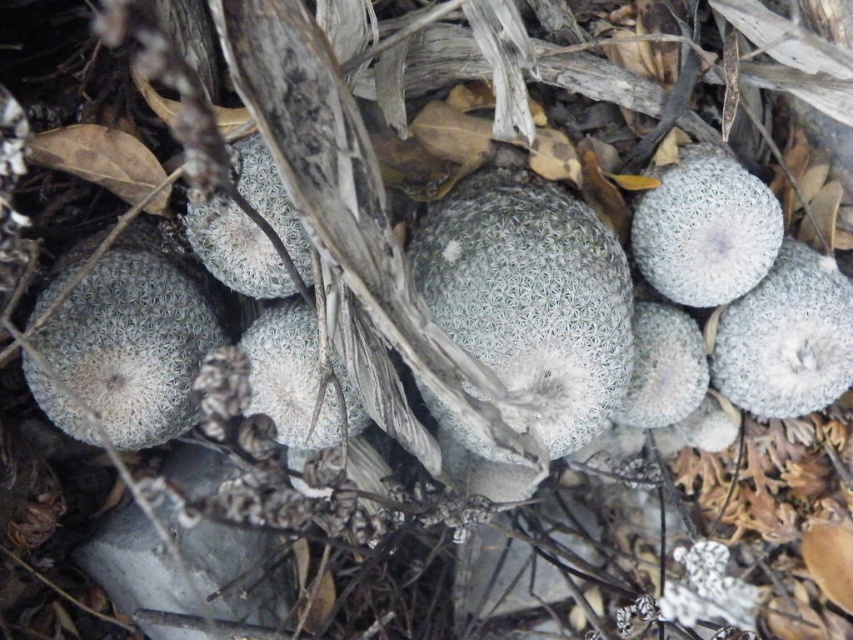
Question: From the image, what is the correct spatial relationship of gray fuzzy cactus at right in relation to white fuzzy cactus at upper right?

Choices:
 (A) below
 (B) above

Answer: (A)

Question: Which is nearer to the white fuzzy cactus at left?

Choices:
 (A) gray fuzzy cactus at right
 (B) white fuzzy cactus at upper right

Answer: (B)

Question: Observing the image, what is the correct spatial positioning of gray fuzzy cactus at right in reference to white fuzzy cactus at upper right?

Choices:
 (A) above
 (B) below

Answer: (B)

Question: Which object is positioned closest to the white fuzzy cactus at upper right?

Choices:
 (A) gray fuzzy cactus at right
 (B) white fuzzy cactus at left
 (C) white fuzzy cactus at center

Answer: (A)

Question: Can you confirm if white fuzzy cactus at center is positioned above white fuzzy cactus at upper right?

Choices:
 (A) yes
 (B) no

Answer: (B)

Question: Among these objects, which one is nearest to the camera?

Choices:
 (A) white fuzzy cactus at upper right
 (B) white fuzzy cactus at center
 (C) white fuzzy cactus at left
 (D) gray fuzzy cactus at right

Answer: (B)